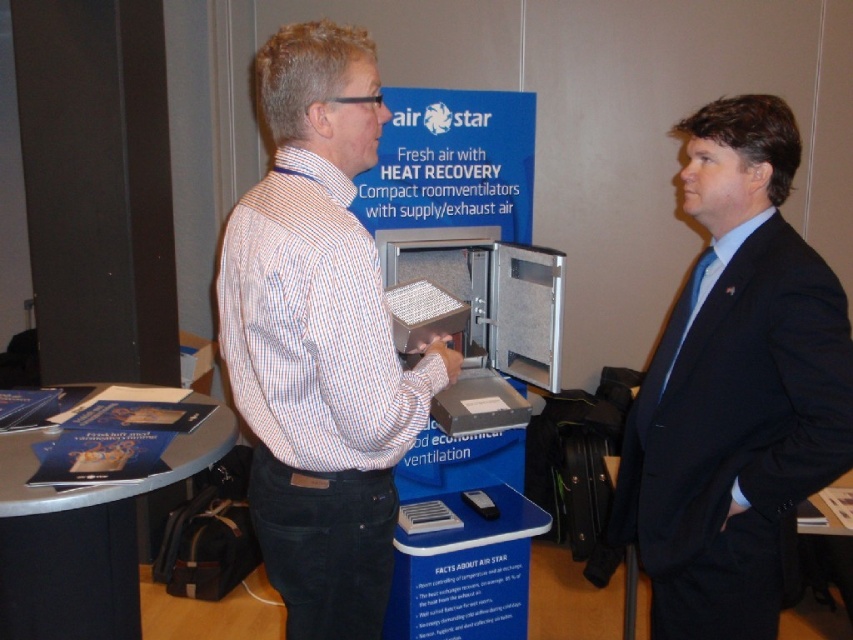
Question: Which of the following is the closest to the observer?

Choices:
 (A) white striped shirt at center
 (B) dark blue suit at right

Answer: (A)

Question: Does white striped shirt at center appear on the left side of blue paper at lower left?

Choices:
 (A) no
 (B) yes

Answer: (A)

Question: Is white striped shirt at center to the right of dark blue suit at right from the viewer's perspective?

Choices:
 (A) no
 (B) yes

Answer: (A)

Question: Which point is farther to the camera?

Choices:
 (A) (737, 116)
 (B) (128, 602)
 (C) (308, 336)

Answer: (B)

Question: Which of the following is the closest to the observer?

Choices:
 (A) (70, 557)
 (B) (335, 444)
 (C) (849, 458)

Answer: (B)

Question: Is dark blue suit at right below blue paper at lower left?

Choices:
 (A) no
 (B) yes

Answer: (A)